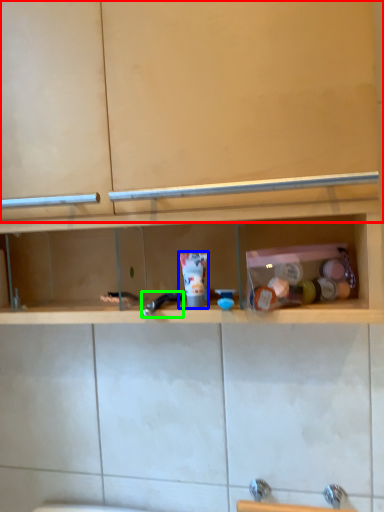
Question: Which object is positioned farthest from cabinet (highlighted by a red box)? Select from toiletry (highlighted by a blue box) and faucet (highlighted by a green box).

Choices:
 (A) toiletry
 (B) faucet

Answer: (B)